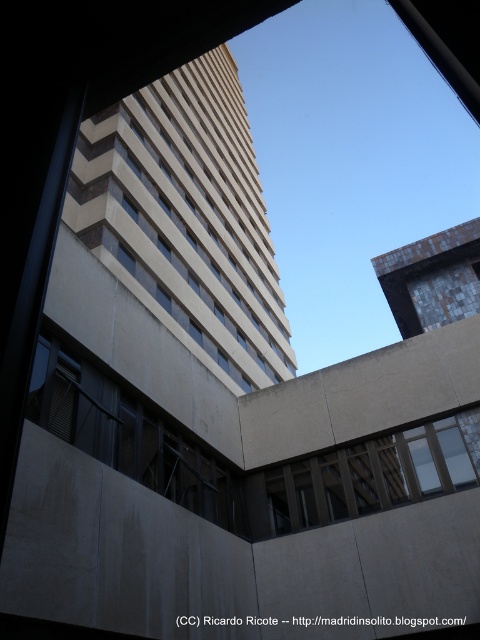
Question: Observing the image, what is the correct spatial positioning of matte concrete window at lower left in reference to brown wooden window at center?

Choices:
 (A) above
 (B) below

Answer: (A)

Question: Does beige concrete building at upper center lie in front of matte concrete window at lower left?

Choices:
 (A) no
 (B) yes

Answer: (A)

Question: Estimate the real-world distances between objects in this image. Which object is closer to the brown wooden window at center?

Choices:
 (A) matte concrete window at lower left
 (B) beige concrete building at upper center

Answer: (A)

Question: Which object is the farthest from the beige concrete building at upper center?

Choices:
 (A) brown wooden window at center
 (B) matte concrete window at lower left

Answer: (B)

Question: Is matte concrete window at lower left above brown wooden window at center?

Choices:
 (A) yes
 (B) no

Answer: (A)

Question: Which object appears closest to the camera in this image?

Choices:
 (A) matte concrete window at lower left
 (B) brown wooden window at center
 (C) beige concrete building at upper center

Answer: (A)